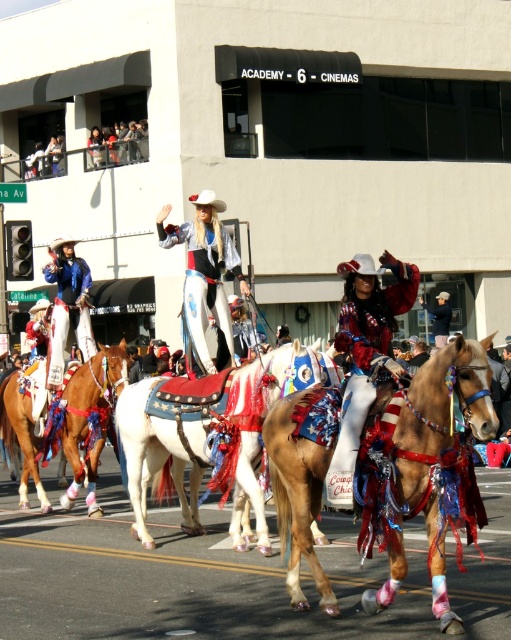
You are a photographer at the parade. You want to capture a photo that includes both the shiny brown horse at center and the matte blue jacket at left. Based on their positions, where should you position the camera to ensure both are in the frame?

Since the shiny brown horse at center is located below the matte blue jacket at left, you should position the camera above the shiny brown horse at center and below the matte blue jacket at left to include both in the frame.

You are a photographer trying to capture the parade scene. You notice two points in the image at coordinates point (260,468) and point (4,404). Which point will appear larger in your photo?

Point (260,468) is closer to the camera than point (4,404), so it will appear larger in the photo.

You are a photographer positioned at the center of the scene. You want to capture a photo of the shiny brown horse at center. Based on its position, which direction should you aim your camera to ensure the horse is in the frame?

The shiny brown horse at center is located at point coordinates, so you should aim your camera towards the center of the scene to capture it.